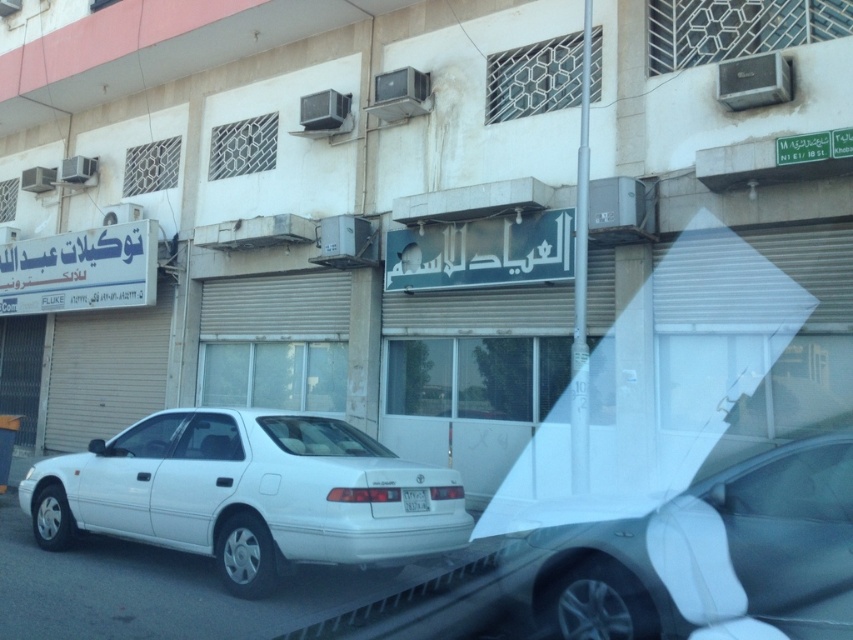
Question: Does white matte sedan at lower left have a greater width compared to white matte car at center?

Choices:
 (A) yes
 (B) no

Answer: (A)

Question: Is white matte car at center to the left of white plastic license plate at center from the viewer's perspective?

Choices:
 (A) yes
 (B) no

Answer: (B)

Question: Which point is farther to the camera?

Choices:
 (A) (285, 452)
 (B) (699, 541)
 (C) (419, 506)

Answer: (A)

Question: Which point is farther from the camera taking this photo?

Choices:
 (A) (422, 500)
 (B) (845, 435)
 (C) (114, 490)

Answer: (C)

Question: Considering the relative positions of white matte sedan at lower left and white plastic license plate at center in the image provided, where is white matte sedan at lower left located with respect to white plastic license plate at center?

Choices:
 (A) below
 (B) above

Answer: (A)

Question: Which is farther from the white matte sedan at lower left?

Choices:
 (A) white matte car at center
 (B) white plastic license plate at center

Answer: (A)